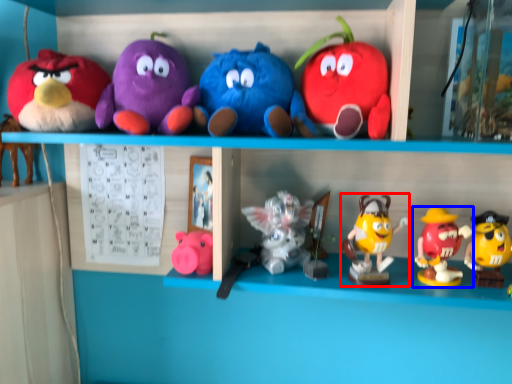
Question: Which point is further to the camera, toy (highlighted by a red box) or toy (highlighted by a blue box)?

Choices:
 (A) toy
 (B) toy

Answer: (A)